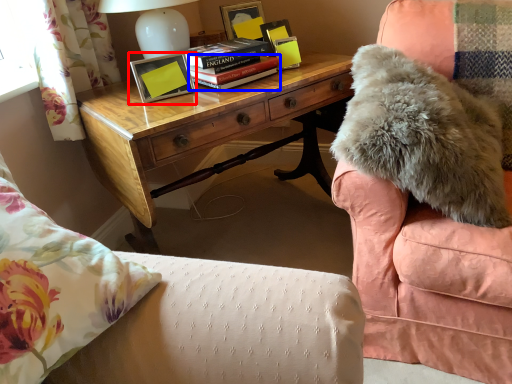
Question: Which of the following is the farthest to the observer, picture frame (highlighted by a red box) or paperback book (highlighted by a blue box)?

Choices:
 (A) picture frame
 (B) paperback book

Answer: (B)